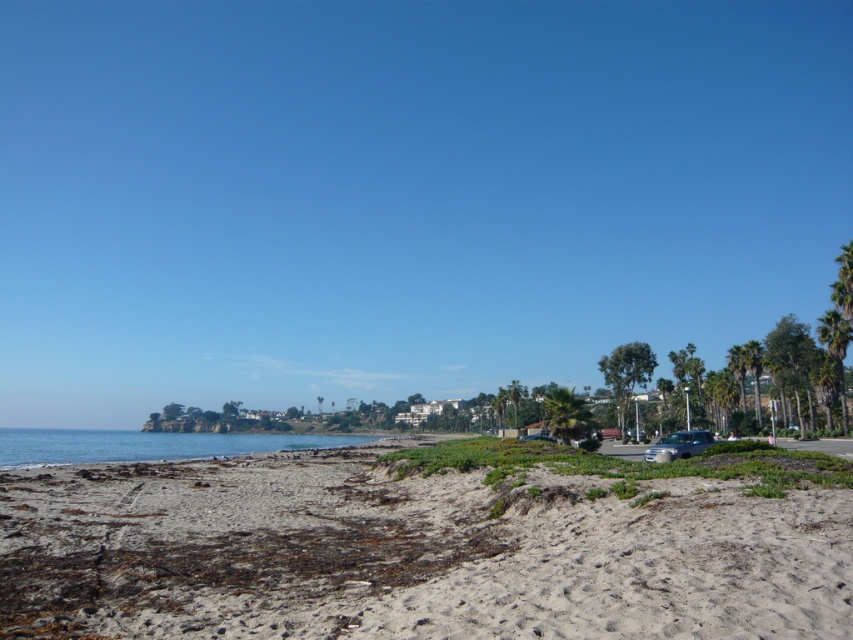
Question: Which object is farther from the camera taking this photo?

Choices:
 (A) green leafy palm tree at center-right
 (B) green leafy palm tree at right

Answer: (A)

Question: Which object appears farthest from the camera in this image?

Choices:
 (A) satin silver sedan at center-right
 (B) brown sandy beach at lower center
 (C) green leafy palm tree at center-right
 (D) green leafy palm tree at right

Answer: (C)

Question: In this image, where is brown sandy beach at lower center located relative to satin silver sedan at center-right?

Choices:
 (A) right
 (B) left

Answer: (B)

Question: Is brown sandy beach at lower center closer to camera compared to green leafy palm tree at right?

Choices:
 (A) yes
 (B) no

Answer: (A)

Question: Does brown sandy beach at lower center come behind green leafy palm tree at center?

Choices:
 (A) yes
 (B) no

Answer: (B)

Question: Among these objects, which one is nearest to the camera?

Choices:
 (A) green leafy palm tree at center-right
 (B) blue water at lower left

Answer: (B)